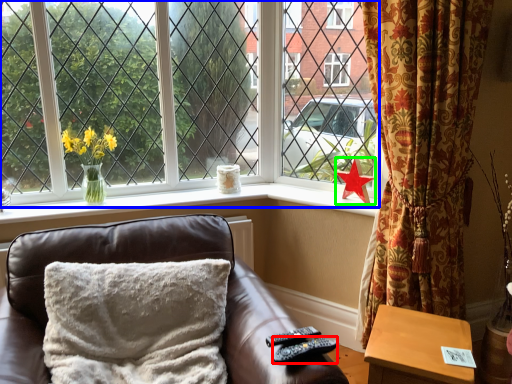
Question: Estimate the real-world distances between objects in this image. Which object is farther from remote (highlighted by a red box), window (highlighted by a blue box) or daffodil (highlighted by a green box)?

Choices:
 (A) window
 (B) daffodil

Answer: (A)